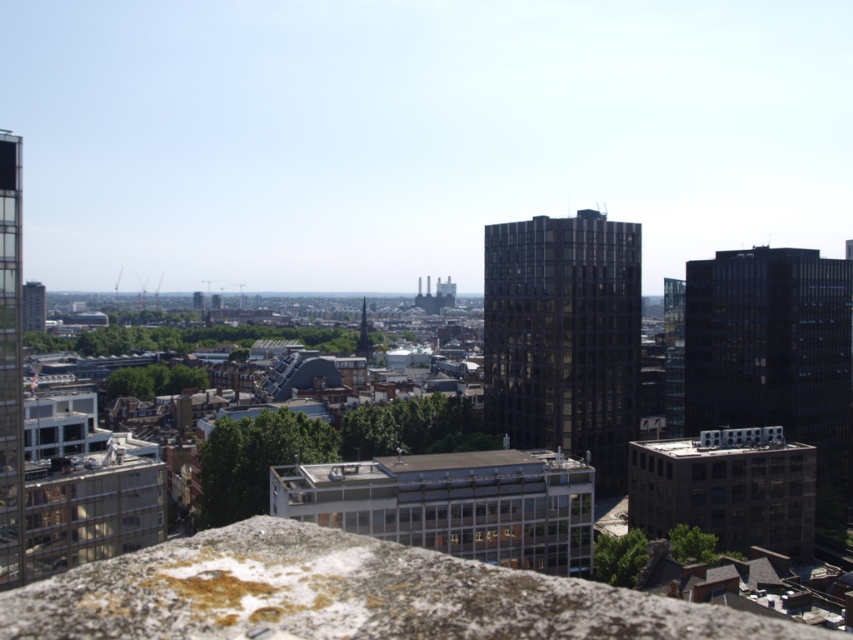
Question: From the image, what is the correct spatial relationship of dark glass building at right in relation to matte glass tower at left?

Choices:
 (A) right
 (B) left

Answer: (A)

Question: Among these points, which one is farthest from the camera?

Choices:
 (A) (6, 145)
 (B) (521, 314)

Answer: (B)

Question: Is the position of dark glass building at right less distant than that of matte glass tower at left?

Choices:
 (A) yes
 (B) no

Answer: (B)

Question: Which point is closer to the camera?

Choices:
 (A) dark glass building at right
 (B) dark glass building at center

Answer: (B)

Question: Based on their relative distances, which object is nearer to the dark glass building at right?

Choices:
 (A) matte glass tower at left
 (B) dark glass building at center

Answer: (B)

Question: Is the position of dark glass building at right more distant than that of matte glass tower at left?

Choices:
 (A) no
 (B) yes

Answer: (B)